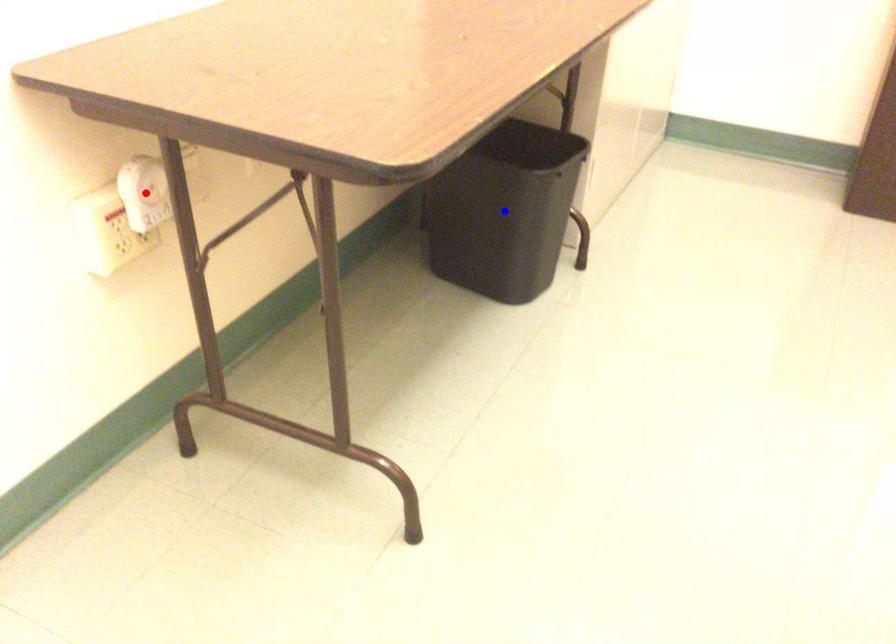
Question: Which of the two points in the image is closer to the camera?

Choices:
 (A) Blue point is closer.
 (B) Red point is closer.

Answer: (B)